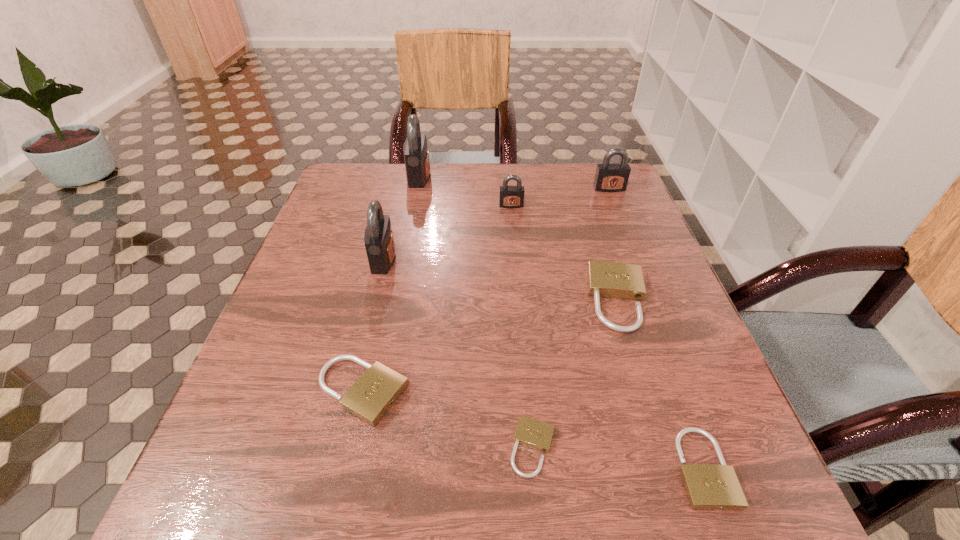
Identify the location of free space located 0.180m on the left of the farthest beige padlock. (502, 300).

Locate an element on the screen. free space located on the front of the third shortest padlock is located at coordinates (331, 532).

You are a GUI agent. You are given a task and a screenshot of the screen. Output one action in this format:
    pyautogui.click(x=<x>, y=<y>)
    Task: Click on the blank space located on the left of the seventh tallest object
    This screenshot has height=540, width=960.
    Given the screenshot: What is the action you would take?
    pyautogui.click(x=563, y=468)

In order to click on free space located 0.220m on the right of the shortest object in this screenshot , I will do 699,448.

Where is `object that is at the far right corner`? object that is at the far right corner is located at coordinates tap(610, 177).

Locate an element on the screen. The image size is (960, 540). object present at the near right corner is located at coordinates (708, 486).

The height and width of the screenshot is (540, 960). Find the location of `vacant space at the far edge of the desktop`. vacant space at the far edge of the desktop is located at coordinates (490, 176).

In the image, there is a desktop. Where is `vacant space at the left edge`? Image resolution: width=960 pixels, height=540 pixels. vacant space at the left edge is located at coordinates (328, 246).

Locate an element on the screen. vacant space at the right edge is located at coordinates (654, 360).

You are a GUI agent. You are given a task and a screenshot of the screen. Output one action in this format:
    pyautogui.click(x=<x>, y=<y>)
    Task: Click on the free region at the far left corner of the desktop
    The width and height of the screenshot is (960, 540).
    Given the screenshot: What is the action you would take?
    pyautogui.click(x=349, y=190)